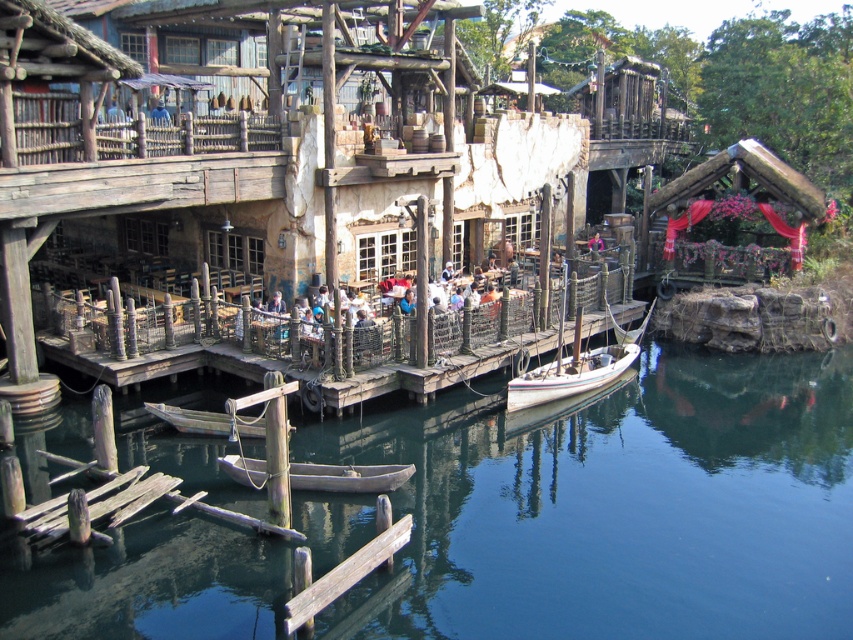
From the picture: Can you confirm if wooden planks at center is positioned to the right of white wooden boat at center?

No, wooden planks at center is not to the right of white wooden boat at center.

Between wooden planks at center and white wooden boat at center, which one is positioned lower?

white wooden boat at center is lower down.

Locate an element on the screen. wooden planks at center is located at coordinates (433, 371).

You are a GUI agent. You are given a task and a screenshot of the screen. Output one action in this format:
    pyautogui.click(x=<x>, y=<y>)
    Task: Click on the wooden planks at center
    The width and height of the screenshot is (853, 640).
    Given the screenshot: What is the action you would take?
    pyautogui.click(x=433, y=371)

Does white wooden boat at center lie in front of wooden boat at center?

That is False.

What do you see at coordinates (569, 376) in the screenshot? I see `white wooden boat at center` at bounding box center [569, 376].

Describe the element at coordinates (569, 376) in the screenshot. I see `white wooden boat at center` at that location.

Locate an element on the screen. The image size is (853, 640). white wooden boat at center is located at coordinates (569, 376).

Measure the distance between wooden planks at center and wooden boat at center.

A distance of 5.85 meters exists between wooden planks at center and wooden boat at center.

Can you confirm if wooden planks at center is positioned to the left of wooden boat at center?

No, wooden planks at center is not to the left of wooden boat at center.

Identify the location of wooden planks at center. (433, 371).